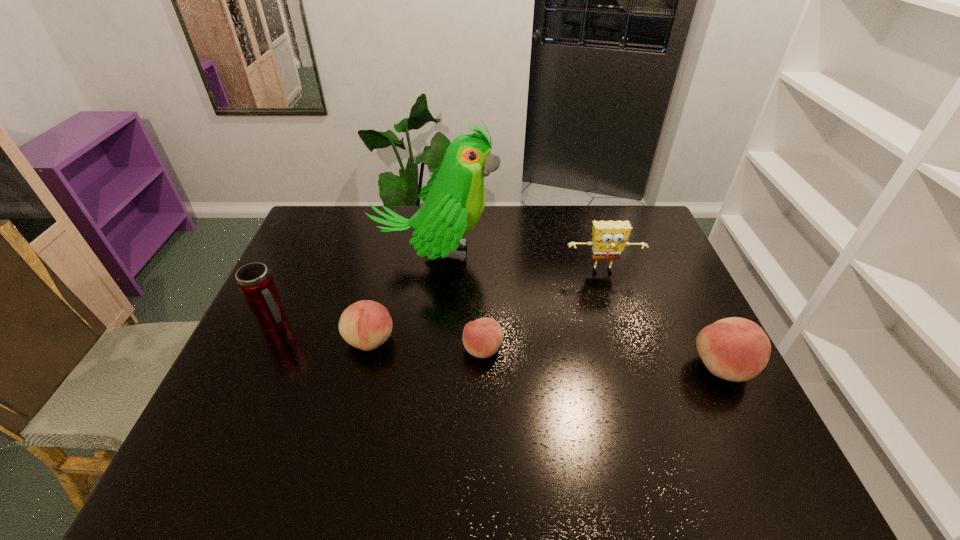
Locate an element on the screen. The width and height of the screenshot is (960, 540). free space that is in between the fifth object from left to right and the tallest object is located at coordinates (519, 263).

At what (x,y) coordinates should I click in order to perform the action: click on vacant region between the sponge and the fifth tallest object. Please return your answer as a coordinate pair (x, y). The image size is (960, 540). Looking at the image, I should click on (486, 307).

At what (x,y) coordinates should I click in order to perform the action: click on vacant point located between the tallest peach and the leftmost peach. Please return your answer as a coordinate pair (x, y). Image resolution: width=960 pixels, height=540 pixels. Looking at the image, I should click on (546, 354).

The image size is (960, 540). In order to click on empty space between the leftmost peach and the parakeet in this screenshot , I will do [x=402, y=298].

Locate which object ranks fourth in proximity to the parakeet. Please provide its 2D coordinates. Your answer should be formatted as a tuple, i.e. [(x, y)], where the tuple contains the x and y coordinates of a point satisfying the conditions above.

[(609, 238)]

In order to click on object that can be found as the third closest to the second object from right to left in this screenshot , I will do `click(482, 338)`.

The width and height of the screenshot is (960, 540). Find the location of `peach that is the second closest to the tallest peach`. peach that is the second closest to the tallest peach is located at coordinates (366, 324).

Identify which peach is the third closest to the thermos bottle. Please provide its 2D coordinates. Your answer should be formatted as a tuple, i.e. [(x, y)], where the tuple contains the x and y coordinates of a point satisfying the conditions above.

[(735, 349)]

Find the location of a particular element. Image resolution: width=960 pixels, height=540 pixels. free space that satisfies the following two spatial constraints: 1. on the beak of the shortest object; 2. on the right side of the parakeet is located at coordinates (425, 349).

Identify the location of vacant space that satisfies the following two spatial constraints: 1. on the face of the fifth object from left to right; 2. on the left side of the third shortest object. (633, 367).